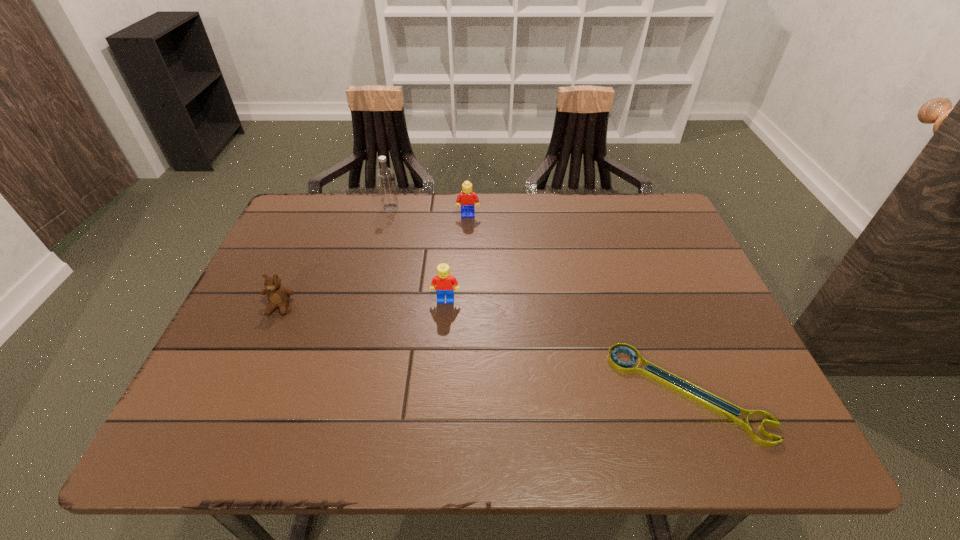
This screenshot has width=960, height=540. In order to click on free space that is in between the nearest object and the farther Lego in this screenshot , I will do `click(578, 304)`.

The image size is (960, 540). What are the coordinates of `free point between the rightmost object and the second farthest object` in the screenshot? It's located at (578, 304).

I want to click on unoccupied area between the wrench and the nearer Lego, so click(x=566, y=346).

Locate an element on the screen. The height and width of the screenshot is (540, 960). empty space that is in between the second shortest object and the farther Lego is located at coordinates (374, 261).

You are a GUI agent. You are given a task and a screenshot of the screen. Output one action in this format:
    pyautogui.click(x=<x>, y=<y>)
    Task: Click on the vacant area that lies between the farther Lego and the nearer Lego
    This screenshot has width=960, height=540.
    Given the screenshot: What is the action you would take?
    pyautogui.click(x=457, y=258)

Locate which object ranks third in proximity to the wrench. Please provide its 2D coordinates. Your answer should be formatted as a tuple, i.e. [(x, y)], where the tuple contains the x and y coordinates of a point satisfying the conditions above.

[(278, 296)]

Locate an element on the screen. object that can be found as the third closest to the nearer Lego is located at coordinates (720, 406).

Where is `vacant position in the image that satisfies the following two spatial constraints: 1. on the face of the nearest object; 2. on the left side of the nearer Lego`? vacant position in the image that satisfies the following two spatial constraints: 1. on the face of the nearest object; 2. on the left side of the nearer Lego is located at coordinates (439, 393).